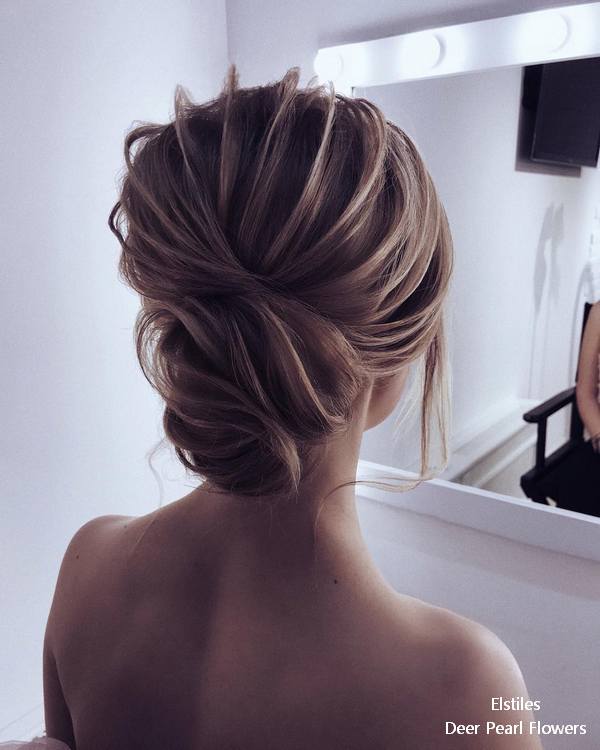
Locate an element on the screen. This screenshot has width=600, height=750. make up light is located at coordinates (477, 44).